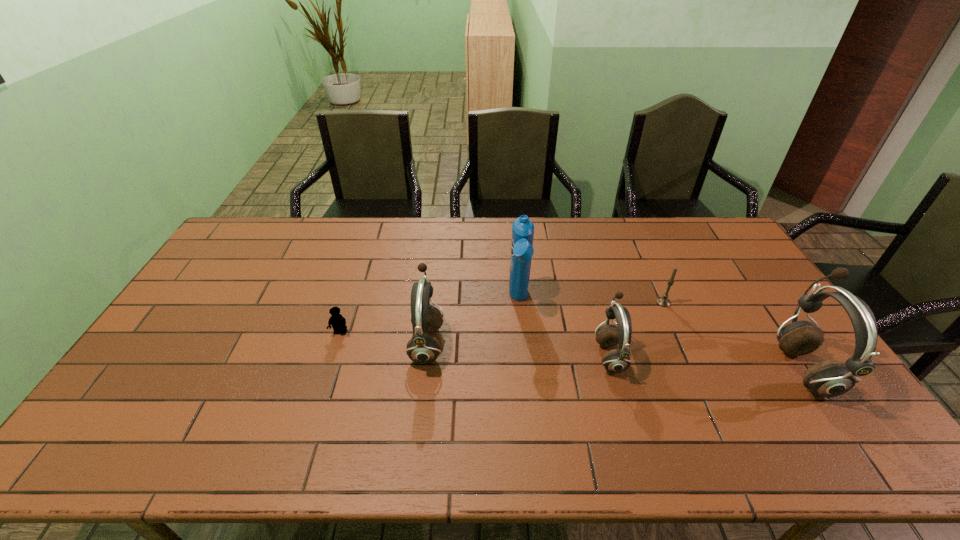
This screenshot has width=960, height=540. Find the location of `vacant space situated 0.210m on the back of the fifth object from left to right`. vacant space situated 0.210m on the back of the fifth object from left to right is located at coordinates (643, 257).

Find the location of `free spot located on the front-facing side of the shortest object`. free spot located on the front-facing side of the shortest object is located at coordinates (334, 354).

The image size is (960, 540). What are the coordinates of `free spot located on the right of the shampoo` in the screenshot? It's located at (633, 300).

At what (x,y) coordinates should I click in order to perform the action: click on object present at the near edge. Please return your answer as a coordinate pair (x, y). The height and width of the screenshot is (540, 960). Looking at the image, I should click on (830, 378).

Where is `object that is at the right edge`? object that is at the right edge is located at coordinates (830, 378).

Where is `object located in the near right corner section of the desktop`? The image size is (960, 540). object located in the near right corner section of the desktop is located at coordinates pos(830,378).

Image resolution: width=960 pixels, height=540 pixels. In order to click on free region at the far edge of the desktop in this screenshot , I will do `click(271, 250)`.

Image resolution: width=960 pixels, height=540 pixels. What are the coordinates of `free region at the near edge of the desktop` in the screenshot? It's located at (479, 391).

The width and height of the screenshot is (960, 540). In the image, there is a desktop. In order to click on blank space at the right edge in this screenshot , I will do `click(765, 362)`.

Identify the location of free space at the far right corner of the desktop. This screenshot has width=960, height=540. (725, 234).